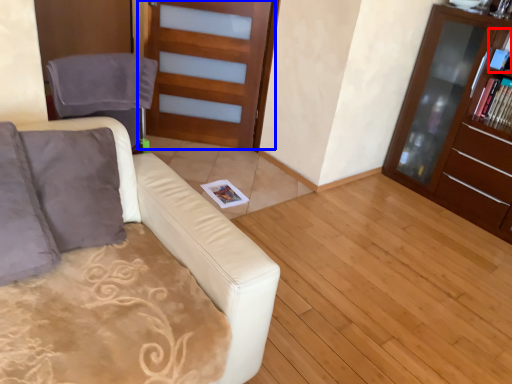
Question: Which of the following is the farthest to the observer, book (highlighted by a red box) or door (highlighted by a blue box)?

Choices:
 (A) book
 (B) door

Answer: (B)